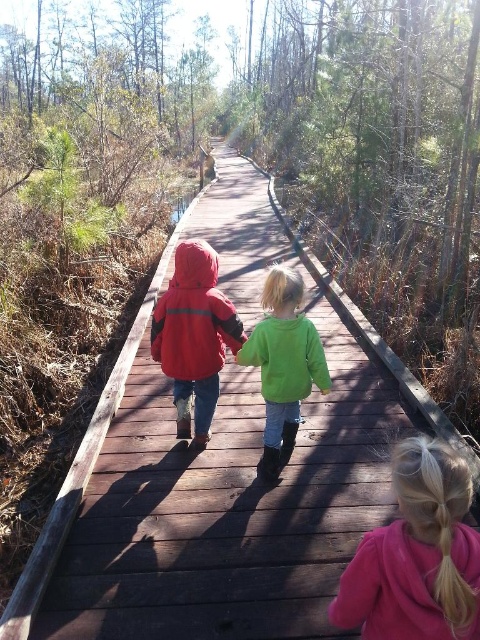
From the picture: You are a photographer standing at the end of the boardwalk. You want to take a photo of both the green fuzzy sweater at center and matte red jacket at center. The camera you have can focus on objects within a 10 inch range. Can you capture both subjects in focus without moving the camera?

The distance between the green fuzzy sweater at center and matte red jacket at center is 12.94 inches. Since the camera can only focus within a 10 inch range, the photographer cannot capture both subjects in focus without moving the camera.

In the scene of the wooden boardwalk through the forest, there are two children wearing the green fuzzy sweater at center and the matte red jacket at center. Which child is wearing the larger clothing item?

The green fuzzy sweater at center is bigger than the matte red jacket at center, so the child wearing the green fuzzy sweater at center has the larger clothing item.